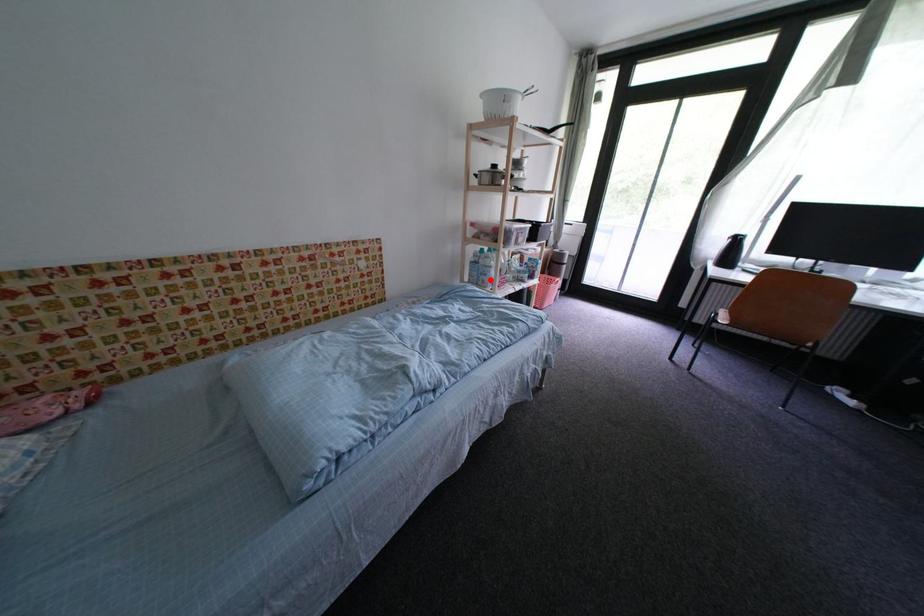
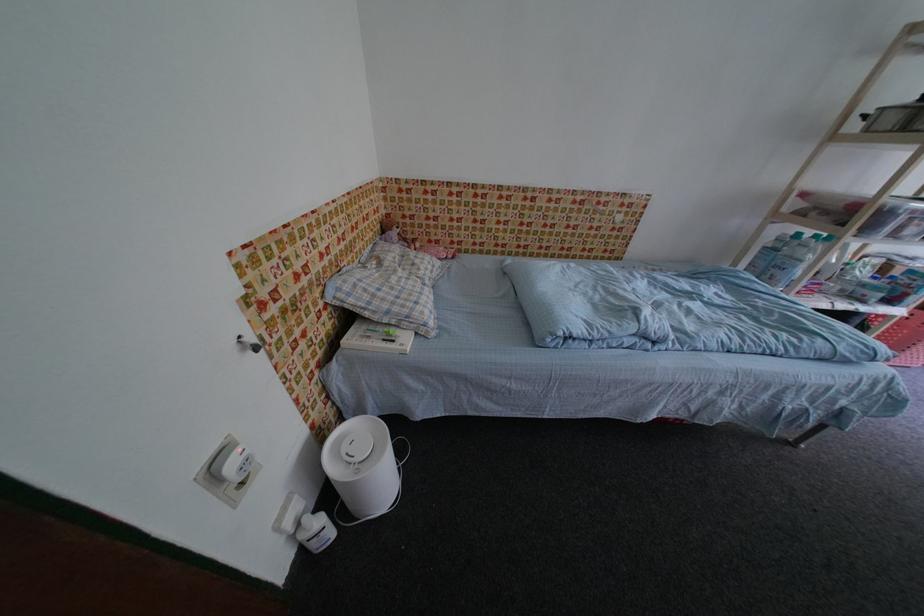
Locate, in the second image, the point that corresponds to the highlighted location in the first image.

(782, 274)